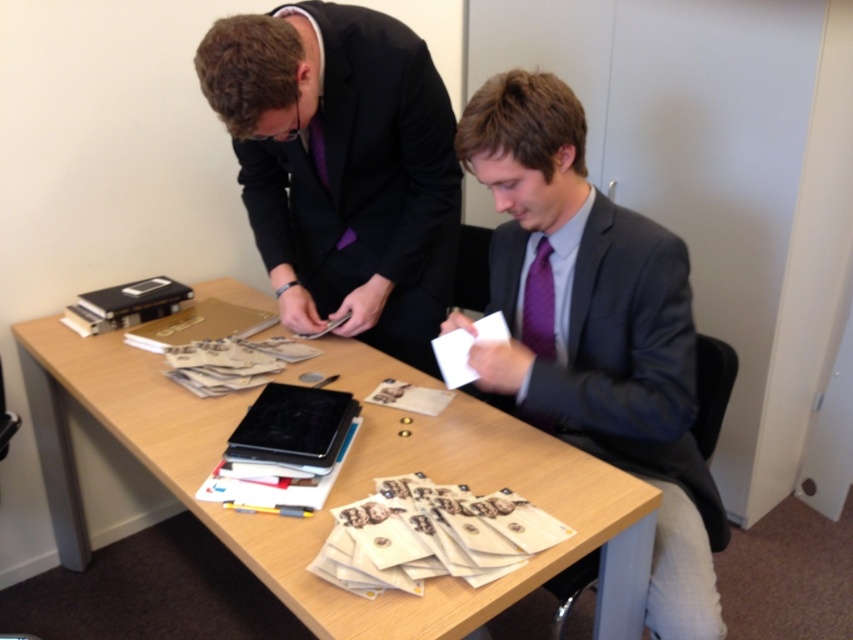
You are an office assistant who needs to place a new document organizer on the table. Given that the light brown wood table at center is larger than the purple satin tie at center, where should you place the organizer to ensure it doesn

The light brown wood table at center is larger than the purple satin tie at center, so you should place the document organizer on the light brown wood table at center since it has more space available.

You are standing in front of the table in the office scene. You notice two points marked on the table surface. The first point is at coordinates point (518, 83) and the second is at point (543, 310). Which of these two points is closer to you?

Point (518, 83) is closer to the viewer than point (543, 310).

You are an office assistant who needs to deliver a document to the person wearing the purple satin tie at center. The document must be placed on the table directly in front of them. Currently, the table has a tablet device, scattered documents, and a pen. Considering the placement of the matte gray suit at center, can you determine if there is enough space on the table to place the document without moving any existing items?

The matte gray suit at center is to the right of the purple satin tie at center. Since the purple satin tie at center is the target, and the table has space around the tablet device, scattered documents, and pen, there should be enough space to place the document without moving items, as the existing items do not block the area directly in front of the purple satin tie at center.